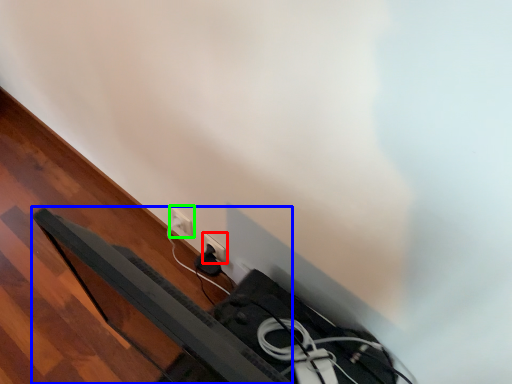
Question: Which object is the farthest from power plugs and sockets (highlighted by a red box)? Choose among these: bed frame (highlighted by a blue box) or power plugs and sockets (highlighted by a green box).

Choices:
 (A) bed frame
 (B) power plugs and sockets

Answer: (A)